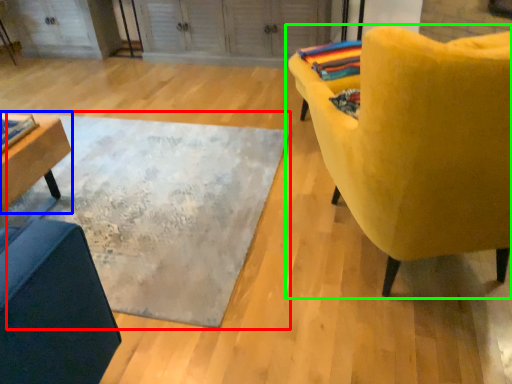
Question: Estimate the real-world distances between objects in this image. Which object is closer to mat (highlighted by a red box), table (highlighted by a blue box) or chair (highlighted by a green box)?

Choices:
 (A) table
 (B) chair

Answer: (A)